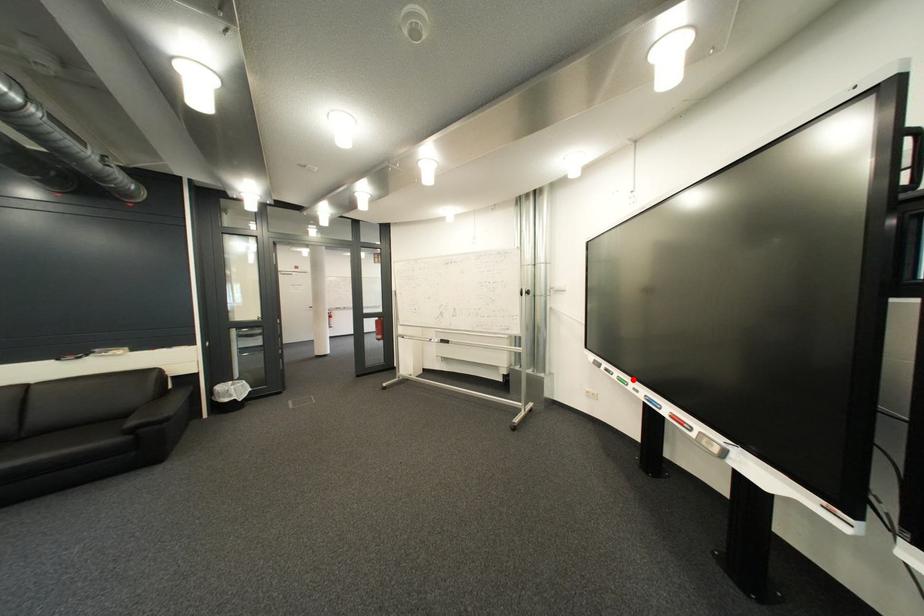
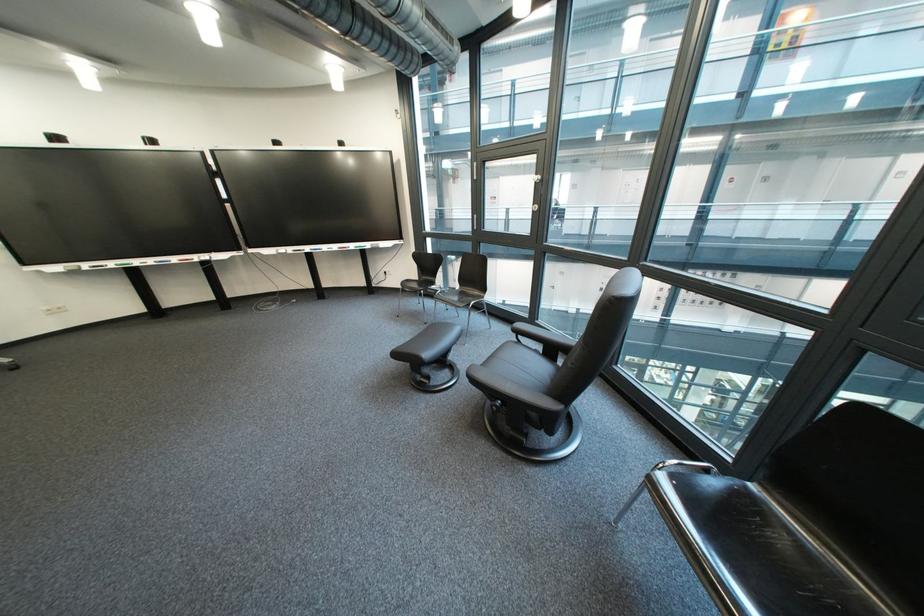
Where in the second image is the point corresponding to the highlighted location from the first image?

(130, 267)